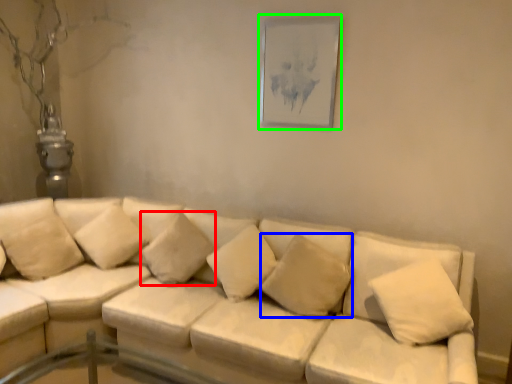
Question: Considering the real-world distances, which object is closest to pillow (highlighted by a red box)? pillow (highlighted by a blue box) or picture frame (highlighted by a green box).

Choices:
 (A) pillow
 (B) picture frame

Answer: (A)